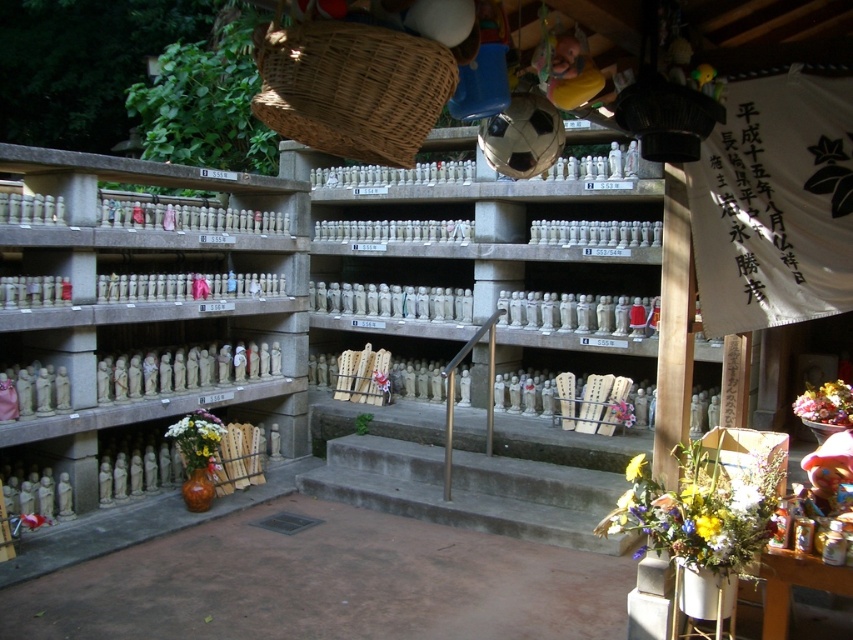
You are standing in the shrine area and want to place a new floral arrangement. The existing white floral bouquet at lower left is 5.62 meters away from you. If your new arrangement is 0.5 meters in diameter, will it fit between you and the existing bouquet without overlapping?

The distance between you and the white floral bouquet at lower left is 5.62 meters. Since your new arrangement is only 0.5 meters in diameter, there is sufficient space to place it between you and the bouquet without overlapping.

You are a visitor at the shrine and want to place a new offering. You have a small statue that needs to be placed closer to the vibrant bouquet at lower right than the yellow fabric flower at center. Where should you place it?

The vibrant bouquet at lower right is closer to the viewer than the yellow fabric flower at center, so placing the statue closer to the vibrant bouquet at lower right would mean positioning it nearer to the front of the shrine area.

You are a visitor at the shrine and want to place a new bouquet between the white floral bouquet at lower left and the fluffy bouquet at lower right. What is the minimum distance you need to walk from one bouquet to the other to place your new bouquet in between?

The white floral bouquet at lower left and fluffy bouquet at lower right are 15.37 feet apart, so you need to walk at least 15.37 feet to place your new bouquet in between them.